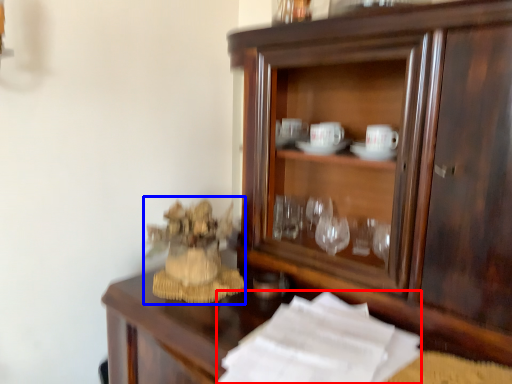
Question: Which object is closer to the camera taking this photo, paper (highlighted by a red box) or toy (highlighted by a blue box)?

Choices:
 (A) paper
 (B) toy

Answer: (A)